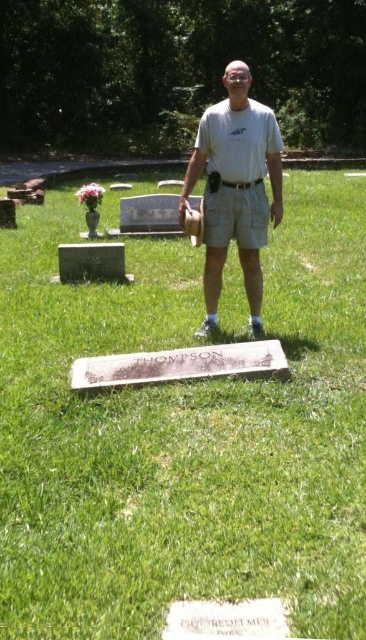
Based on the scene description, which object is taller between the green grass at center and the white cotton shirt at center?

The green grass at center is taller than the white cotton shirt at center.

Based on the photo, you are a photographer trying to capture the man in the white cotton shirt at center without including the green marble gravestone at center in the shot. Based on their positions, is this possible?

Yes, since the white cotton shirt at center is in front of the green marble gravestone at center, you can position the camera so that the shirt blocks the gravestone from view, thus excluding it from the photo.

You are a groundskeeper at the cemetery. You need to place a new flowerpot that is 1 meter wide between the green grass at center and the green marble gravestone at center. Is there enough space to place it without moving either object?

The green grass at center and green marble gravestone at center are 1.30 meters apart. Since the flowerpot is 1 meter wide, there is enough space to place it between them without moving either object.